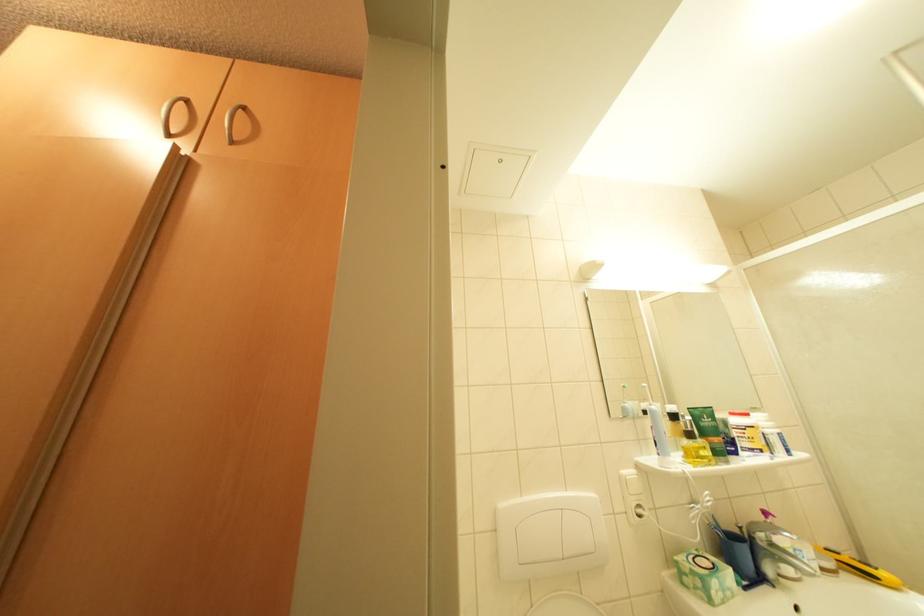
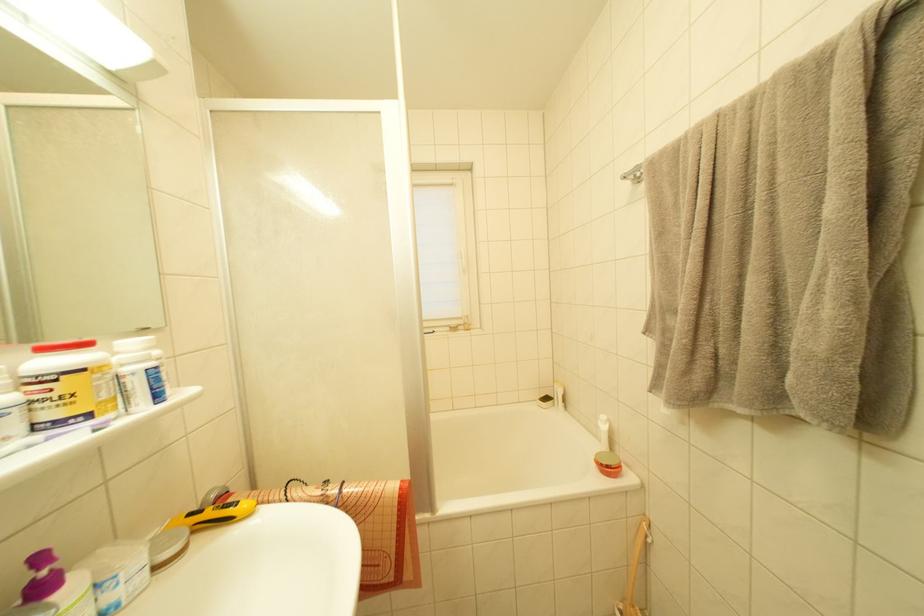
Question: Based on the continuous images, in which direction is the camera rotating? Reply with the corresponding letter.

Choices:
 (A) Left
 (B) Right
 (C) Up
 (D) Down

Answer: (B)